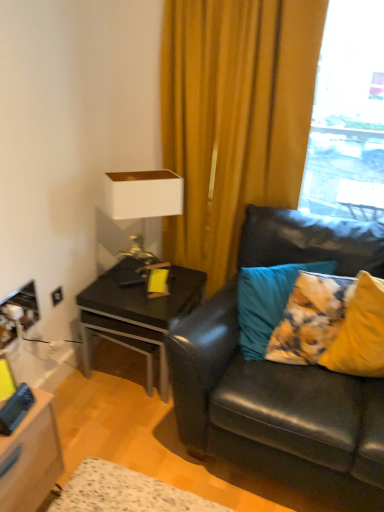
Question: From the image's perspective, is black leather couch at right located above or below black glossy side table at left?

Choices:
 (A) above
 (B) below

Answer: (A)

Question: In the image, is black leather couch at right on the left side or the right side of black glossy side table at left?

Choices:
 (A) right
 (B) left

Answer: (A)

Question: Estimate the real-world distances between objects in this image. Which object is farther from the black leather couch at right?

Choices:
 (A) teal fabric pillow at right, the 1th pillow in the left-to-right sequence
 (B) black glossy side table at left
 (C) white matte table lamp at upper left
 (D) yellow fabric pillow at right, which is the 1th pillow from right to left
 (E) transparent glass window at upper right

Answer: (E)

Question: Which object is positioned farthest from the yellow fabric curtain at upper center?

Choices:
 (A) yellow fabric pillow at right, which is the 1th pillow from right to left
 (B) black glossy side table at left
 (C) black leather couch at right
 (D) teal fabric pillow at right, marked as the second pillow in a right-to-left arrangement
 (E) transparent glass window at upper right

Answer: (E)